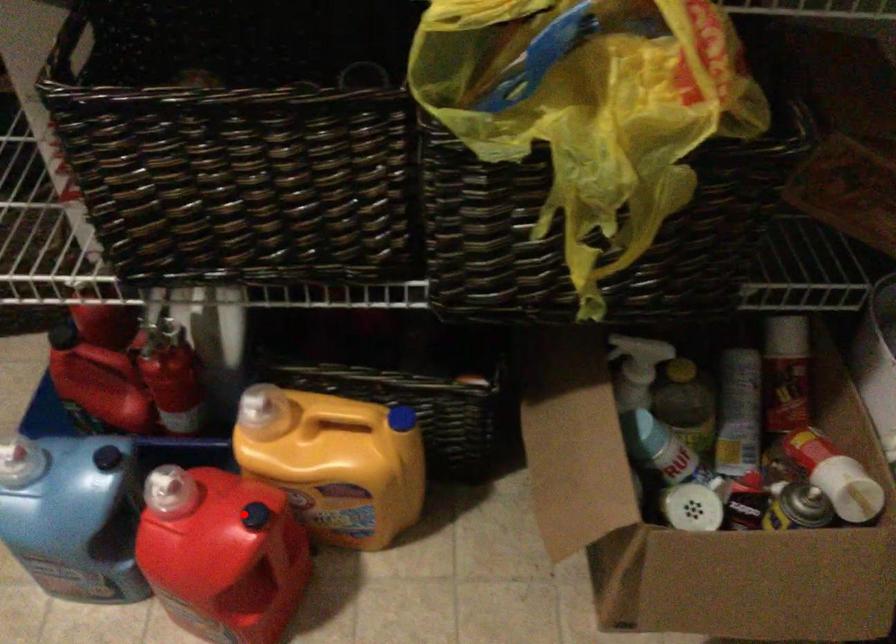
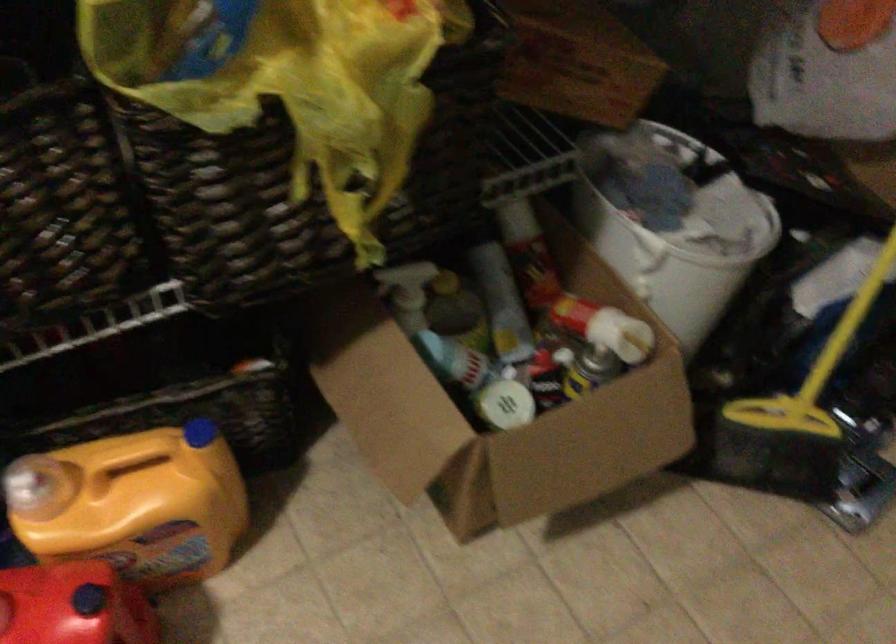
Question: I am providing you with two images of the same scene from different viewpoints. A red point is shown in image1. For the corresponding object point in image2, is it positioned nearer or farther from the camera?

Choices:
 (A) Nearer
 (B) Farther

Answer: (A)